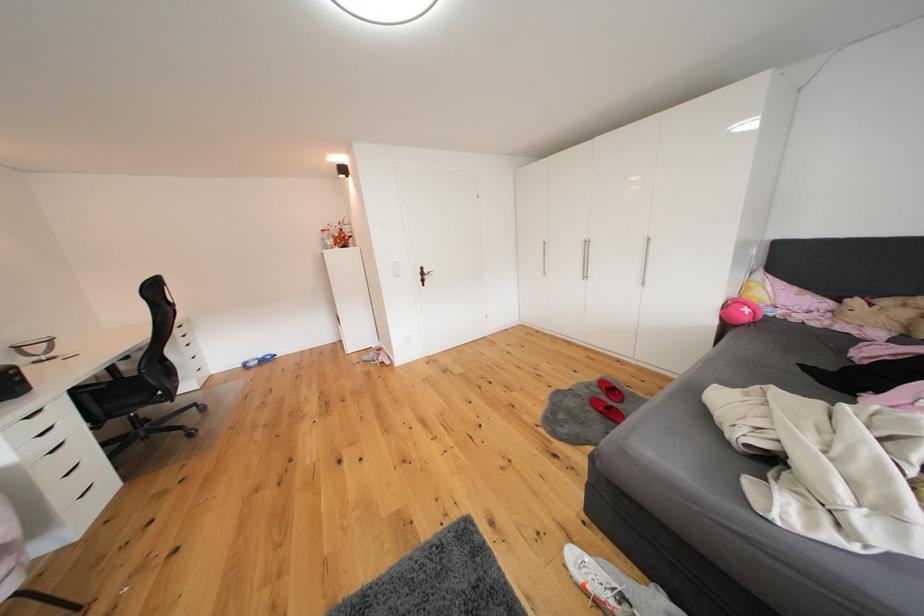
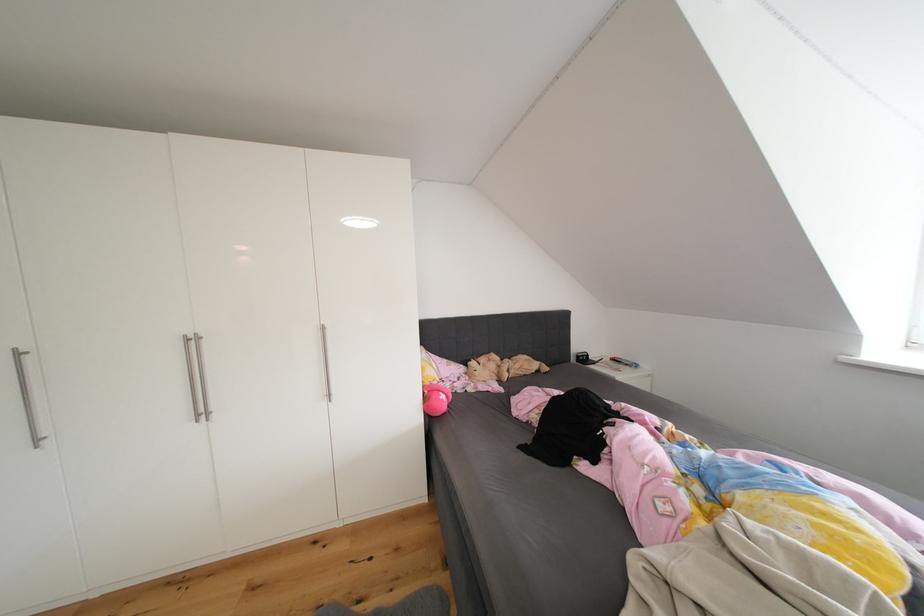
Where in the second image is the point corresponding to point (596, 246) from the first image?

(201, 344)